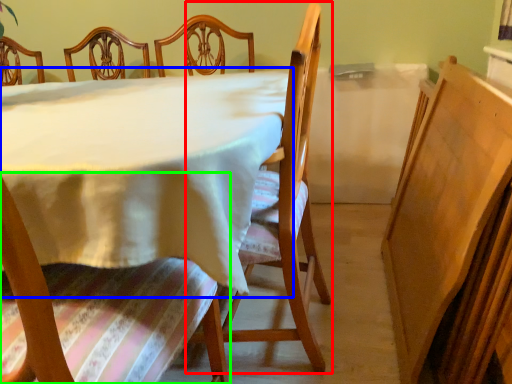
Question: Which object is the farthest from chair (highlighted by a red box)? Choose among these: table (highlighted by a blue box) or chair (highlighted by a green box).

Choices:
 (A) table
 (B) chair

Answer: (B)